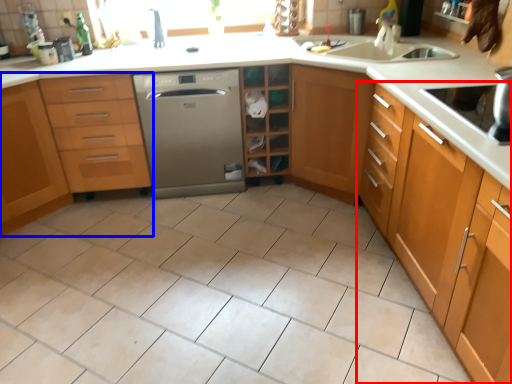
Question: Among these objects, which one is farthest to the camera, cabinetry (highlighted by a red box) or cabinetry (highlighted by a blue box)?

Choices:
 (A) cabinetry
 (B) cabinetry

Answer: (B)